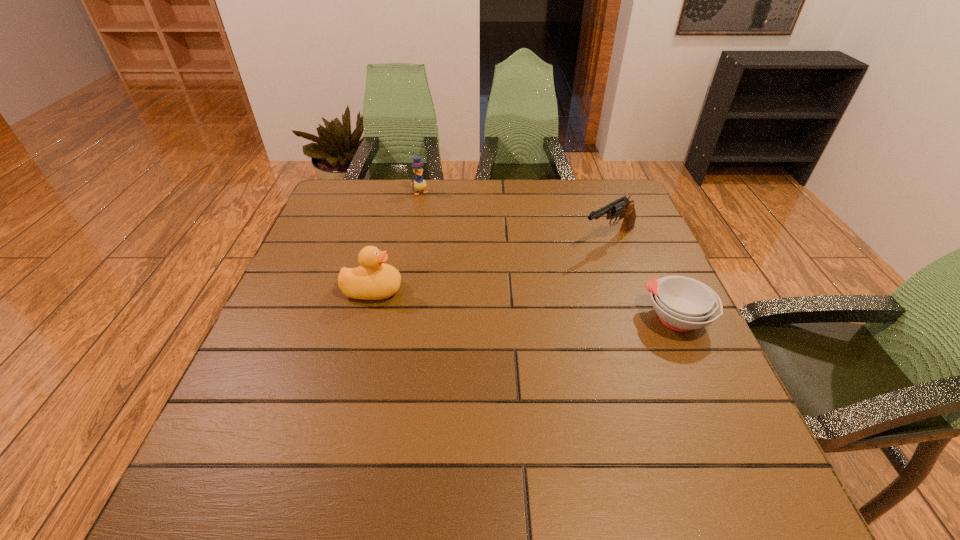
Locate an element on the screen. vacant space at the far left corner of the desktop is located at coordinates (370, 183).

Find the location of a particular element. vacant space at the far right corner of the desktop is located at coordinates (596, 185).

At what (x,y) coordinates should I click in order to perform the action: click on vacant area that lies between the duckling and the gun. Please return your answer as a coordinate pair (x, y). The width and height of the screenshot is (960, 540). Looking at the image, I should click on click(515, 216).

Where is `vacant space that's between the third nearest object and the shortest object`? This screenshot has width=960, height=540. vacant space that's between the third nearest object and the shortest object is located at coordinates (643, 279).

Where is `blank region between the farthest object and the gun`? This screenshot has width=960, height=540. blank region between the farthest object and the gun is located at coordinates (515, 216).

Locate an element on the screen. This screenshot has height=540, width=960. free point between the second farthest object and the duckling is located at coordinates (515, 216).

This screenshot has height=540, width=960. I want to click on vacant point located between the farthest object and the third nearest object, so click(x=515, y=216).

The image size is (960, 540). I want to click on vacant area that lies between the duckling and the gun, so click(x=515, y=216).

Locate an element on the screen. vacant area between the duck and the duckling is located at coordinates (396, 241).

Identify the location of vacant point located between the gun and the duck. (491, 265).